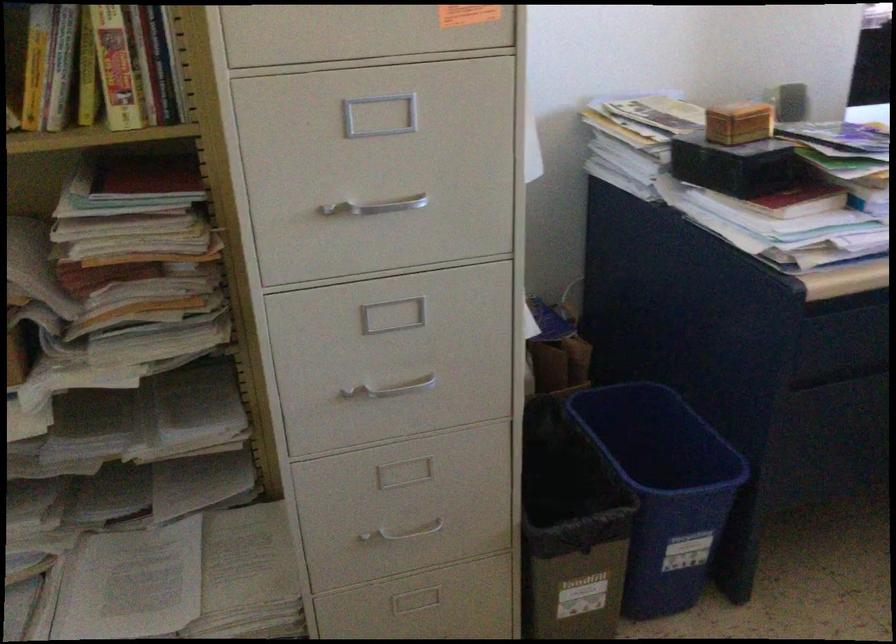
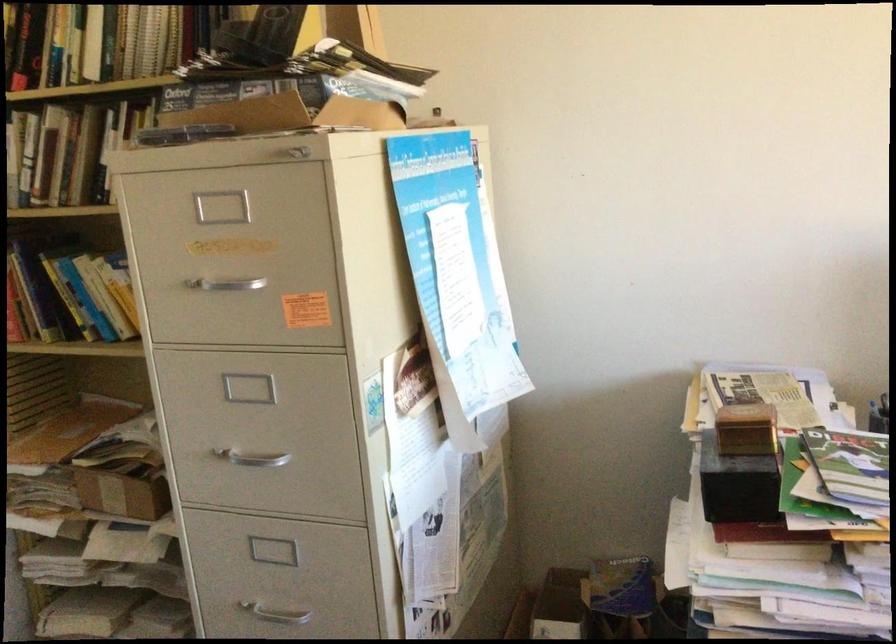
In the second image, find the point that corresponds to pixel 386 384 in the first image.

(273, 608)